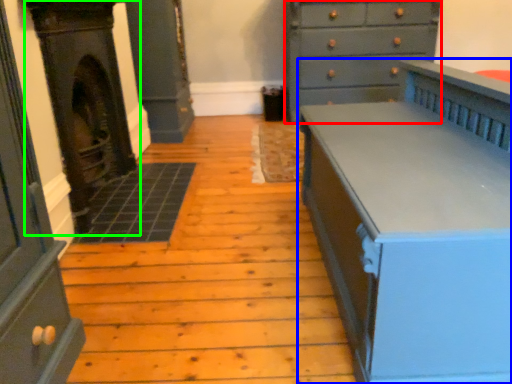
Question: Considering the real-world distances, which object is farthest from chest of drawers (highlighted by a red box)? chest of drawers (highlighted by a blue box) or fireplace (highlighted by a green box)?

Choices:
 (A) chest of drawers
 (B) fireplace

Answer: (B)